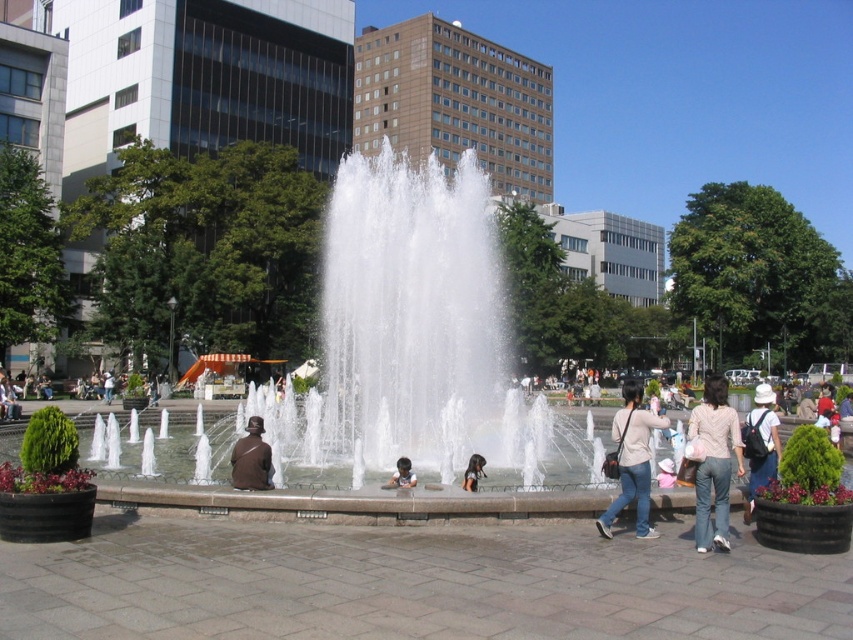
Question: In this image, where is clear water fountain at center located relative to smooth brown hair at center?

Choices:
 (A) left
 (B) right

Answer: (B)

Question: Which is nearer to the smooth brown hair at center?

Choices:
 (A) smooth skin face at center
 (B) clear water fountain at center

Answer: (A)

Question: Which object is the farthest from the light pink cotton shirt at right?

Choices:
 (A) smooth skin face at center
 (B) white fabric hat at center
 (C) smooth brown hair at center
 (D) clear water fountain at center

Answer: (D)

Question: Estimate the real-world distances between objects in this image. Which object is closer to the brown leather jacket at center?

Choices:
 (A) matte beige bag at center
 (B) light pink cotton shirt at right

Answer: (B)

Question: Is light pink cotton shirt at right positioned at the back of brown leather jacket at center?

Choices:
 (A) yes
 (B) no

Answer: (B)

Question: Can you confirm if light pink cotton shirt at right is positioned to the left of brown leather jacket at center?

Choices:
 (A) no
 (B) yes

Answer: (A)